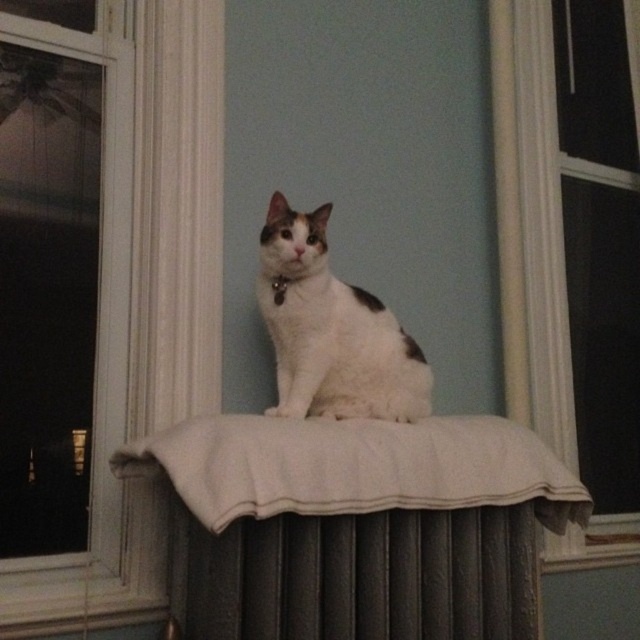
You are a photographer trying to capture a clear shot of the dark gray metal radiator at center and the black fabric neckband at center. However, you notice that one of the objects is closer to you than the other. Which object should you focus on to ensure both are in sharp focus?

You should focus on the dark gray metal radiator at center because it is closer to the viewer than the black fabric neckband at center. By focusing on the closer object, the depth of field may extend to include the farther object in acceptable focus.

You are standing in the room and want to check the weather outside through the transparent glass window at upper left. Where should you look on the window?

You should look at point (67, 317) on the transparent glass window at upper left to check the weather outside.

You are trying to determine if the white fur cat at center can comfortably stretch out on the dark gray metal radiator at center. Based on their sizes, can the cat fit entirely on the radiator without hanging off?

The dark gray metal radiator at center is wider than the white fur cat at center, so the cat can fit entirely on the radiator without hanging off.